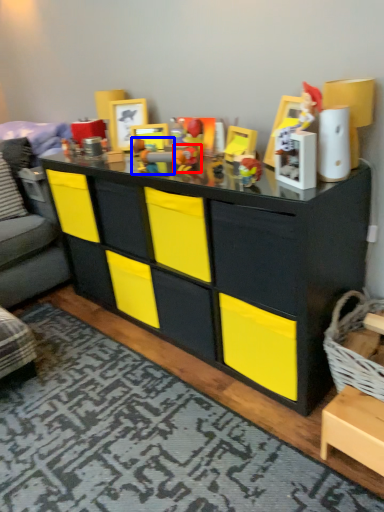
Question: Which point is further to the camera, toy (highlighted by a red box) or toy (highlighted by a blue box)?

Choices:
 (A) toy
 (B) toy

Answer: (A)